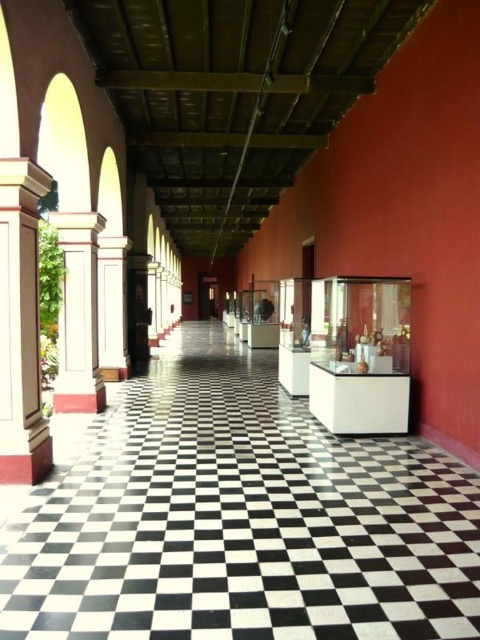
Does smooth white column at left have a greater width compared to white painted wood column at left?

Incorrect, smooth white column at left's width does not surpass white painted wood column at left's.

Does point (2, 300) lie in front of point (72, 276)?

Yes, it is in front of point (72, 276).

Is point (36, 339) less distant than point (79, 276)?

Yes, point (36, 339) is in front of point (79, 276).

Locate an element on the screen. This screenshot has height=640, width=480. smooth white column at left is located at coordinates (21, 324).